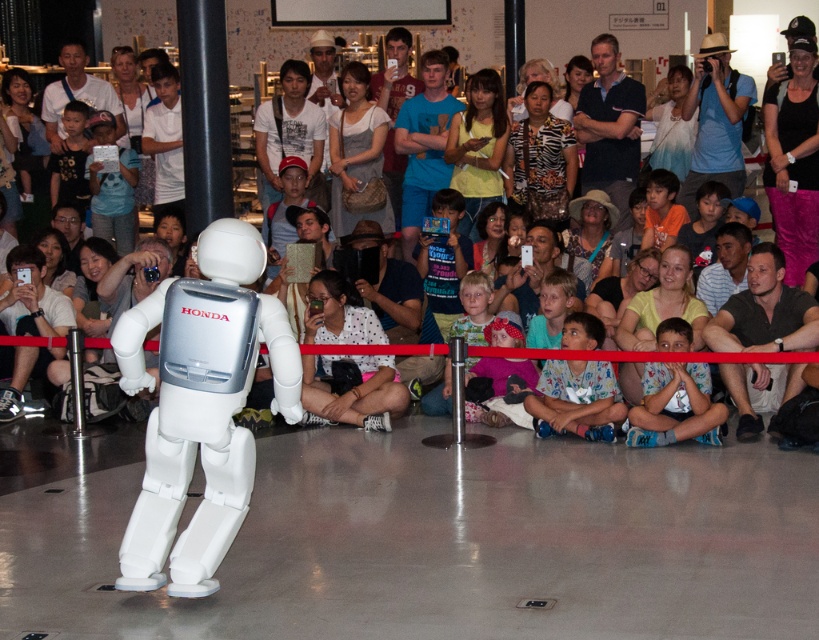
Can you confirm if pink fabric at upper right is positioned above matte blue shirt at upper right?

Actually, pink fabric at upper right is below matte blue shirt at upper right.

Is point (790, 109) positioned before point (734, 77)?

Yes, point (790, 109) is closer to viewer.

Identify the location of pink fabric at upper right. The image size is (819, 640). coord(793,160).

Is light blue fabric shirt at lower right bigger than white fabric crowd at center?

Incorrect, light blue fabric shirt at lower right is not larger than white fabric crowd at center.

Based on the photo, can you confirm if light blue fabric shirt at lower right is smaller than white fabric crowd at center?

Yes.

Is point (675, 374) less distant than point (211, 128)?

Yes.

Find the location of a particular element. The width and height of the screenshot is (819, 640). light blue fabric shirt at lower right is located at coordinates (673, 404).

Can you confirm if blue cotton shirt at upper center is positioned above white t-shirt at center?

Incorrect, blue cotton shirt at upper center is not positioned above white t-shirt at center.

Identify the location of blue cotton shirt at upper center. (609, 125).